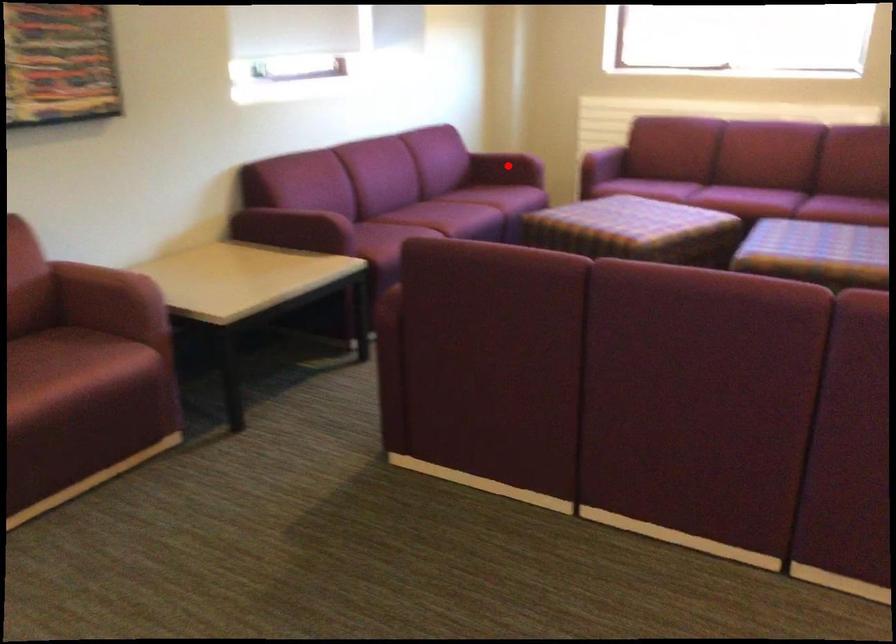
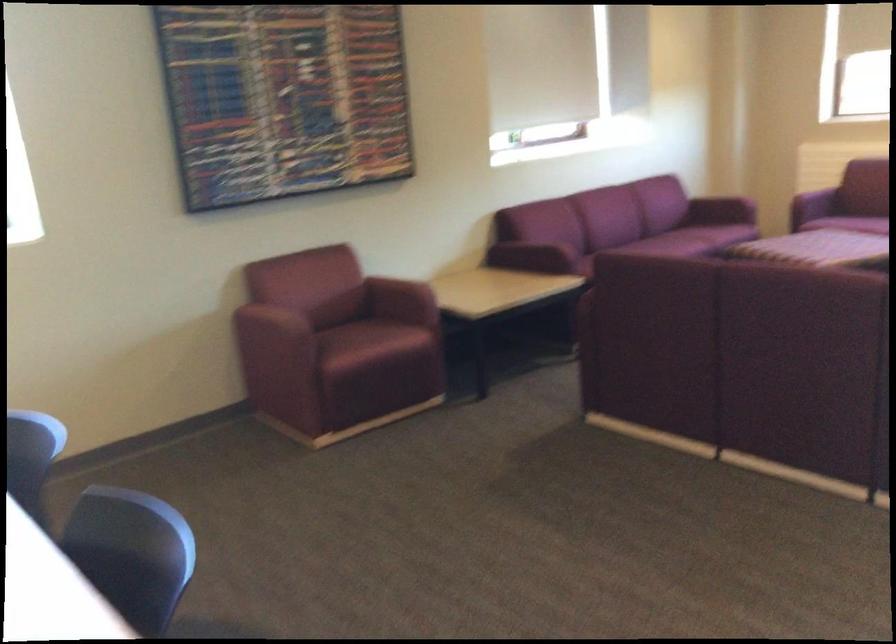
Question: I am providing you with two images of the same scene from different viewpoints. Image1 has a red point marked. In image2, the corresponding 3D location appears at what relative position? Reply with the corresponding letter.

Choices:
 (A) Closer
 (B) Farther

Answer: (B)